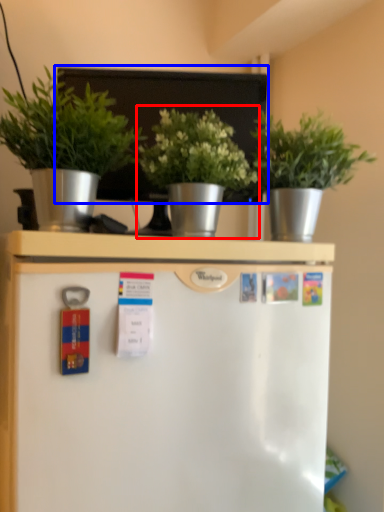
Question: Among these objects, which one is farthest to the camera, houseplant (highlighted by a red box) or bulletin board (highlighted by a blue box)?

Choices:
 (A) houseplant
 (B) bulletin board

Answer: (B)